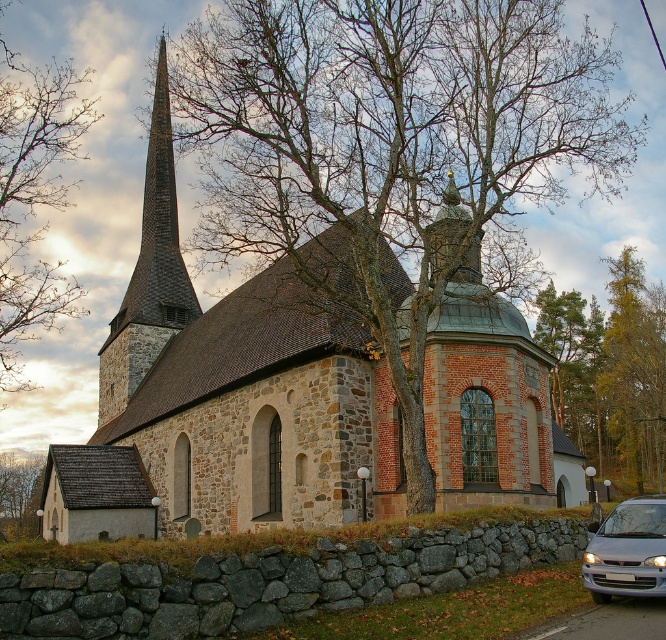
You are a photographer planning to capture the church in this scene. You notice the bare branches at left and the silver metallic car at lower right. Which object is wider in the image?

The bare branches at left might be wider than the silver metallic car at lower right according to the description.

What is the 2D coordinate of the bare branches at left in the image?

The 2D coordinate of the bare branches at left is at point (33,196).